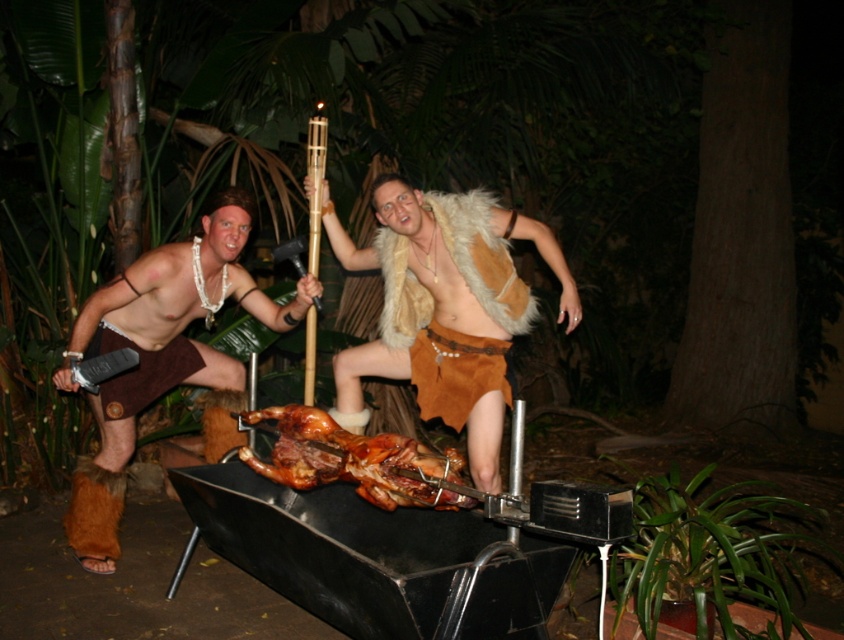
Question: Which point is farther from the camera taking this photo?

Choices:
 (A) (428, 500)
 (B) (406, 272)
 (C) (452, 356)
 (D) (204, 358)

Answer: (D)

Question: Which point is farther to the camera?

Choices:
 (A) pos(326,477)
 (B) pos(442,225)
 (C) pos(155,378)
 (D) pos(504,372)

Answer: (C)

Question: Is fur-covered vest at center below fur vest at center?

Choices:
 (A) yes
 (B) no

Answer: (A)

Question: Observing the image, what is the correct spatial positioning of fur-covered vest at center in reference to golden brown roasted lamb at center?

Choices:
 (A) below
 (B) above

Answer: (B)

Question: Does brown leather shorts at left appear over fur-covered vest at center?

Choices:
 (A) yes
 (B) no

Answer: (B)

Question: Which object is the closest to the brown leather shorts at left?

Choices:
 (A) fur vest at center
 (B) fur-covered vest at center

Answer: (B)